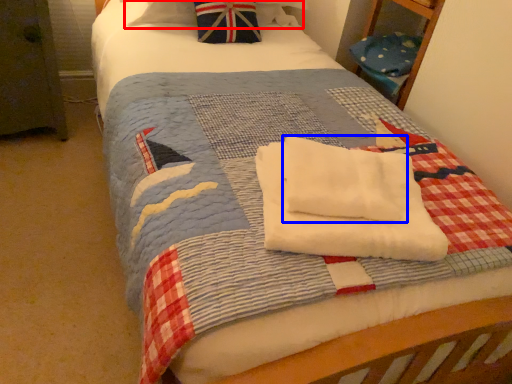
Question: Which object is further to the camera taking this photo, pillow (highlighted by a red box) or beach towel (highlighted by a blue box)?

Choices:
 (A) pillow
 (B) beach towel

Answer: (A)